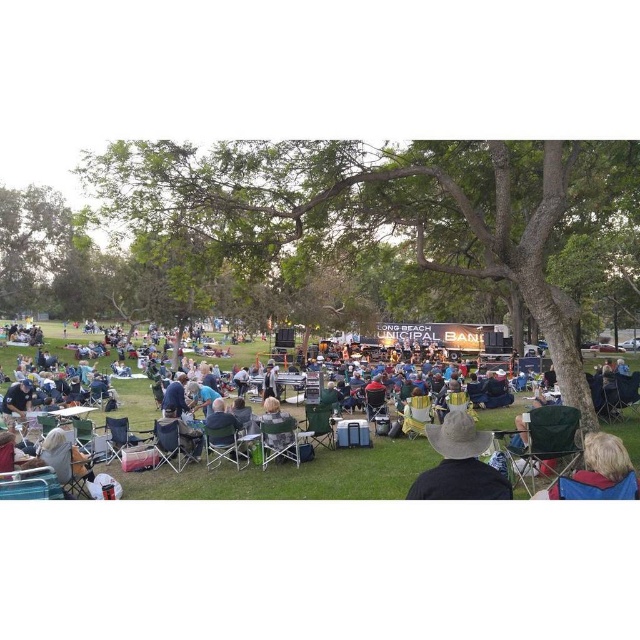
Where is `dark blue fabric chair at center`? dark blue fabric chair at center is located at coordinates (296, 476).

Who is positioned more to the right, dark blue fabric chair at center or brown straw hat at center?

From the viewer's perspective, brown straw hat at center appears more on the right side.

What do you see at coordinates (296, 476) in the screenshot? This screenshot has height=640, width=640. I see `dark blue fabric chair at center` at bounding box center [296, 476].

Where is `dark blue fabric chair at center`? dark blue fabric chair at center is located at coordinates (x=296, y=476).